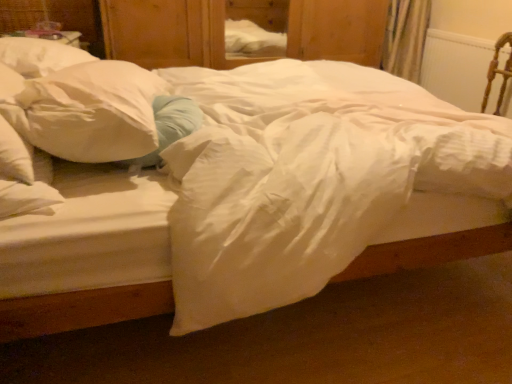
Question: From a real-world perspective, does wooden dresser at center stand above wooden armchair at right?

Choices:
 (A) no
 (B) yes

Answer: (B)

Question: From the image's perspective, is wooden dresser at center above wooden armchair at right?

Choices:
 (A) yes
 (B) no

Answer: (A)

Question: Can you confirm if wooden dresser at center is taller than wooden armchair at right?

Choices:
 (A) no
 (B) yes

Answer: (B)

Question: Is wooden armchair at right inside wooden dresser at center?

Choices:
 (A) no
 (B) yes

Answer: (A)

Question: Is wooden dresser at center to the left of wooden armchair at right from the viewer's perspective?

Choices:
 (A) no
 (B) yes

Answer: (B)

Question: Is wooden dresser at center behind wooden armchair at right?

Choices:
 (A) yes
 (B) no

Answer: (A)

Question: Is wooden armchair at right further to camera compared to wooden dresser at center?

Choices:
 (A) yes
 (B) no

Answer: (B)

Question: Does wooden armchair at right lie in front of wooden dresser at center?

Choices:
 (A) no
 (B) yes

Answer: (B)

Question: Could you tell me if wooden armchair at right is turned towards wooden dresser at center?

Choices:
 (A) yes
 (B) no

Answer: (B)

Question: From the image's perspective, does wooden armchair at right appear higher than wooden dresser at center?

Choices:
 (A) yes
 (B) no

Answer: (B)

Question: From a real-world perspective, does wooden armchair at right sit lower than wooden dresser at center?

Choices:
 (A) yes
 (B) no

Answer: (A)

Question: Is wooden armchair at right bigger than wooden dresser at center?

Choices:
 (A) no
 (B) yes

Answer: (A)

Question: Could you tell me if white soft pillow at left is turned towards white plastic radiator at upper right?

Choices:
 (A) no
 (B) yes

Answer: (B)